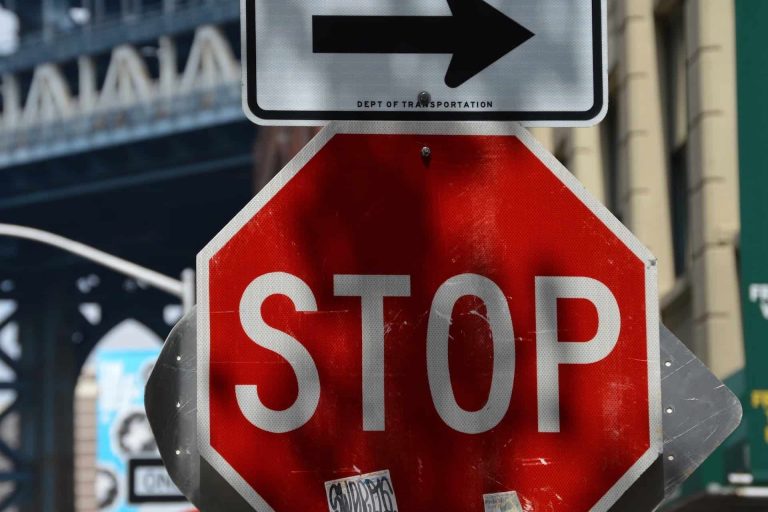
This screenshot has height=512, width=768. Identify the location of archway, blurry. (84, 435).